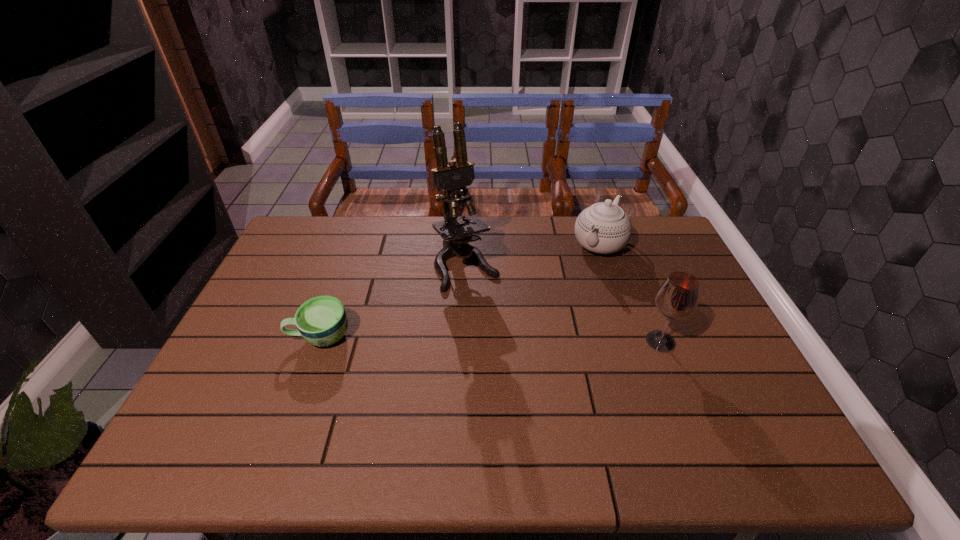
In the image, there is a desktop. Where is `blank space at the right edge`? This screenshot has height=540, width=960. blank space at the right edge is located at coordinates (750, 377).

Image resolution: width=960 pixels, height=540 pixels. I want to click on free space at the far right corner of the desktop, so coord(641,225).

Where is `free point between the shortest object and the microscope`? The width and height of the screenshot is (960, 540). free point between the shortest object and the microscope is located at coordinates (394, 301).

Image resolution: width=960 pixels, height=540 pixels. I want to click on free space between the third tallest object and the microscope, so 533,255.

Where is `unoccupied position between the cup and the second object from left to right`? The height and width of the screenshot is (540, 960). unoccupied position between the cup and the second object from left to right is located at coordinates (394, 301).

Identify the location of vacant area that lies between the wineglass and the second shortest object. The image size is (960, 540). (630, 293).

This screenshot has width=960, height=540. In order to click on free space between the leftmost object and the microscope in this screenshot , I will do `click(394, 301)`.

Where is `vacant space that's between the third object from right to left and the wineglass`? The image size is (960, 540). vacant space that's between the third object from right to left and the wineglass is located at coordinates (564, 303).

Identify the location of free space that is in between the cup and the third tallest object. (460, 291).

Image resolution: width=960 pixels, height=540 pixels. What are the coordinates of `free space that is in between the shortest object and the microscope` in the screenshot? It's located at (394, 301).